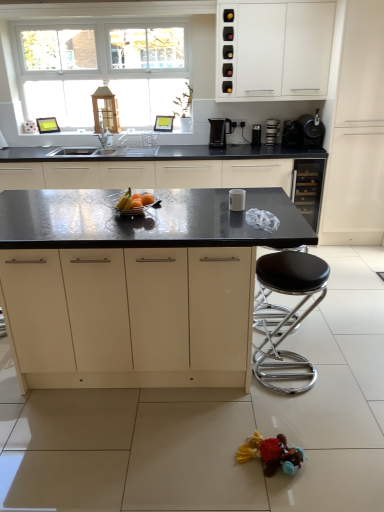
What do you see at coordinates (272, 131) in the screenshot? Image resolution: width=384 pixels, height=512 pixels. I see `metallic silver coffee maker at upper right, acting as the third appliance starting from the front` at bounding box center [272, 131].

How much space does black glass wine cooler at right, placed as the 2th cabinetry when sorted from right to left, occupy vertically?

black glass wine cooler at right, placed as the 2th cabinetry when sorted from right to left, is 28.31 inches tall.

The image size is (384, 512). Find the location of `black glass wine cooler at right, placed as the 2th cabinetry when sorted from right to left`. black glass wine cooler at right, placed as the 2th cabinetry when sorted from right to left is located at coordinates (308, 188).

This screenshot has width=384, height=512. I want to click on multicolored fabric toy at lower right, so click(271, 454).

How much space does matte black countertop at center, arranged as the 4th cabinetry when viewed from the right, occupy horizontally?

It is 5.93 feet.

In order to face matte black countertop at center, arranged as the 4th cabinetry when viewed from the right, should I rotate leftwards or rightwards?

It's best to rotate left around 6.831 degrees.

Based on the photo, what is the approximate width of black plastic coffee machine at upper center?

8.04 inches.

What do you see at coordinates (220, 131) in the screenshot?
I see `black plastic coffee machine at upper center` at bounding box center [220, 131].

You are a GUI agent. You are given a task and a screenshot of the screen. Output one action in this format:
    pyautogui.click(x=<x>, y=<y>)
    Task: Click on the metallic silver coffee maker at upper right, placed as the third appliance when sorted from left to right
    Image resolution: width=384 pixels, height=512 pixels.
    Given the screenshot: What is the action you would take?
    pyautogui.click(x=272, y=131)

From a real-world perspective, which object stands above the other?

From a 3D spatial view, black granite countertop at center, marked as the 5th cabinetry in a right-to-left arrangement, is above.

Locate an element on the screen. The width and height of the screenshot is (384, 512). stool in front of the black granite countertop at center, marked as the 5th cabinetry in a right-to-left arrangement is located at coordinates (285, 316).

Can you tell me how much black leather stool at right and shiny metallic bowl at center differ in facing direction?

89.3 degrees separate the facing orientations of black leather stool at right and shiny metallic bowl at center.

Is shiny metallic bowl at center at the back of black leather stool at right?

No.

This screenshot has width=384, height=512. What are the coordinates of `fruit above the black leather stool at right (from a real-world perspective)` in the screenshot? It's located at (125, 201).

Is matte black countertop at center, which is the 2th cabinetry from left to right, positioned with its back to black plastic coffee machine at upper center?

No, matte black countertop at center, which is the 2th cabinetry from left to right, is not facing away from black plastic coffee machine at upper center.

Consider the image. Between matte black countertop at center, arranged as the 4th cabinetry when viewed from the right, and black plastic coffee machine at upper center, which one appears on the right side from the viewer's perspective?

black plastic coffee machine at upper center.

Can you see matte black countertop at center, which is the 2th cabinetry from left to right, touching black plastic coffee machine at upper center?

No, matte black countertop at center, which is the 2th cabinetry from left to right, is not next to black plastic coffee machine at upper center.

Can you tell me how much matte black countertop at center, arranged as the 4th cabinetry when viewed from the right, and black plastic coffee machine at upper center differ in facing direction?

The angular difference between matte black countertop at center, arranged as the 4th cabinetry when viewed from the right, and black plastic coffee machine at upper center is 96.1 degrees.

Considering the relative positions of metallic silver bowl at center and black leather stool at right in the image provided, is metallic silver bowl at center in front of black leather stool at right?

No.

Is metallic silver bowl at center at the right side of black leather stool at right?

Incorrect, metallic silver bowl at center is not on the right side of black leather stool at right.

From the image's perspective, which is above, metallic silver bowl at center or black leather stool at right?

From the image's view, metallic silver bowl at center is above.

Would you say metallic silver bowl at center is outside black leather stool at right?

Yes, metallic silver bowl at center is not within black leather stool at right.

Which object is positioned more to the left, white glossy cup at center, the fourth appliance in the back-to-front sequence, or matte black countertop at center, arranged as the 4th cabinetry when viewed from the right?

From the viewer's perspective, matte black countertop at center, arranged as the 4th cabinetry when viewed from the right, appears more on the left side.

Is white glossy cup at center, the fourth appliance in the back-to-front sequence, with matte black countertop at center, arranged as the 4th cabinetry when viewed from the right?

No, white glossy cup at center, the fourth appliance in the back-to-front sequence, is not beside matte black countertop at center, arranged as the 4th cabinetry when viewed from the right.

Based on the photo, which is closer to the camera, (241, 192) or (131, 276)?

Point (241, 192) is farther from the camera than point (131, 276).

Are black plastic coffee machine at upper center and metallic silver bowl at center making contact?

No, black plastic coffee machine at upper center is not touching metallic silver bowl at center.

Measure the distance from black plastic coffee machine at upper center to metallic silver bowl at center.

6.05 feet.

Between black plastic coffee machine at upper center and metallic silver bowl at center, which one has larger size?

Bigger between the two is black plastic coffee machine at upper center.

Considering the sizes of objects metallic silver coffee maker at upper right, placed as the third appliance when sorted from left to right, and multicolored fabric toy at lower right in the image provided, who is thinner, metallic silver coffee maker at upper right, placed as the third appliance when sorted from left to right, or multicolored fabric toy at lower right?

metallic silver coffee maker at upper right, placed as the third appliance when sorted from left to right, is thinner.

Is there a large distance between metallic silver coffee maker at upper right, the second appliance positioned from the back, and multicolored fabric toy at lower right?

Yes, metallic silver coffee maker at upper right, the second appliance positioned from the back, and multicolored fabric toy at lower right are quite far apart.

Considering the relative positions of metallic silver coffee maker at upper right, acting as the 4th appliance starting from the bottom, and multicolored fabric toy at lower right in the image provided, is metallic silver coffee maker at upper right, acting as the 4th appliance starting from the bottom, behind multicolored fabric toy at lower right?

Yes, metallic silver coffee maker at upper right, acting as the 4th appliance starting from the bottom, is further from the viewer.

Where is `stool in front of the black granite countertop at center, which appears as the first cabinetry when viewed from the left`? The width and height of the screenshot is (384, 512). stool in front of the black granite countertop at center, which appears as the first cabinetry when viewed from the left is located at coordinates (285, 316).

Identify the location of fruit behind the black leather stool at right. This screenshot has height=512, width=384. (125, 201).

Considering their positions, is black plastic coffee maker at upper right, which is counted as the third appliance, starting from the top, positioned further to black plastic coffee machine at upper center than black plastic toaster at upper center, which is counted as the first appliance, starting from the back?

Among the two, black plastic coffee maker at upper right, which is counted as the third appliance, starting from the top, is located further to black plastic coffee machine at upper center.

Looking at the image, which one is located further to white glossy cup at center, the fourth appliance in the back-to-front sequence, white matte cabinet at upper right, the third cabinetry viewed from the right, or matte black countertop at center, which is the 2th cabinetry from left to right?

white matte cabinet at upper right, the third cabinetry viewed from the right, is further to white glossy cup at center, the fourth appliance in the back-to-front sequence.

Based on their spatial positions, is black plastic coffee maker at upper right, which is counted as the third appliance, starting from the top, or black granite countertop at center, marked as the 5th cabinetry in a right-to-left arrangement, further from white matte cabinet at upper right, the third cabinetry viewed from the right?

Among the two, black granite countertop at center, marked as the 5th cabinetry in a right-to-left arrangement, is located further to white matte cabinet at upper right, the third cabinetry viewed from the right.

Based on their spatial positions, is metallic silver coffee maker at upper right, acting as the 4th appliance starting from the bottom, or shiny metallic bowl at center closer to matte white cabinet at right, marked as the 1th cabinetry in a right-to-left arrangement?

Among the two, metallic silver coffee maker at upper right, acting as the 4th appliance starting from the bottom, is located nearer to matte white cabinet at right, marked as the 1th cabinetry in a right-to-left arrangement.

Based on their spatial positions, is white matte cabinet at upper right, the third cabinetry viewed from the right, or shiny metallic bowl at center closer to black plastic toaster at upper center, which is the second appliance from left to right?

white matte cabinet at upper right, the third cabinetry viewed from the right, is closer to black plastic toaster at upper center, which is the second appliance from left to right.

Considering their positions, is black plastic coffee machine at upper center positioned closer to metallic silver bowl at center than black granite countertop at center, marked as the 5th cabinetry in a right-to-left arrangement?

black granite countertop at center, marked as the 5th cabinetry in a right-to-left arrangement.

Looking at this image, considering their positions, is black plastic coffee maker at upper right, placed as the 2th appliance when sorted from front to back, positioned further to white matte cabinet at upper right, acting as the third cabinetry starting from the left, than black leather stool at right?

Based on the image, black leather stool at right appears to be further to white matte cabinet at upper right, acting as the third cabinetry starting from the left.

Considering their positions, is white glossy cup at center, which appears as the 1th appliance when viewed from the left, positioned closer to metallic silver bowl at center than black glass wine cooler at right, placed as the 2th cabinetry when sorted from right to left?

Among the two, white glossy cup at center, which appears as the 1th appliance when viewed from the left, is located nearer to metallic silver bowl at center.

I want to click on coffee machine between matte black countertop at center, arranged as the 4th cabinetry when viewed from the right, and black plastic toaster at upper center, which is counted as the first appliance, starting from the back, in the front-back direction, so click(220, 131).

At what (x,y) coordinates should I click in order to perform the action: click on fruit between white matte cabinet at upper right, acting as the third cabinetry starting from the left, and white glossy cup at center, the fourth appliance in the back-to-front sequence, vertically. Please return your answer as a coordinate pair (x, y). This screenshot has height=512, width=384. Looking at the image, I should click on (125, 201).

This screenshot has width=384, height=512. Find the location of `appliance located between multicolored fabric toy at lower right and black glass wine cooler at right, placed as the 2th cabinetry when sorted from right to left, in the depth direction`. appliance located between multicolored fabric toy at lower right and black glass wine cooler at right, placed as the 2th cabinetry when sorted from right to left, in the depth direction is located at coordinates (237, 200).

Locate an element on the screen. Image resolution: width=384 pixels, height=512 pixels. coffee machine between matte black countertop at center, arranged as the 4th cabinetry when viewed from the right, and metallic silver coffee maker at upper right, positioned as the second appliance in right-to-left order, in the front-back direction is located at coordinates (220, 131).